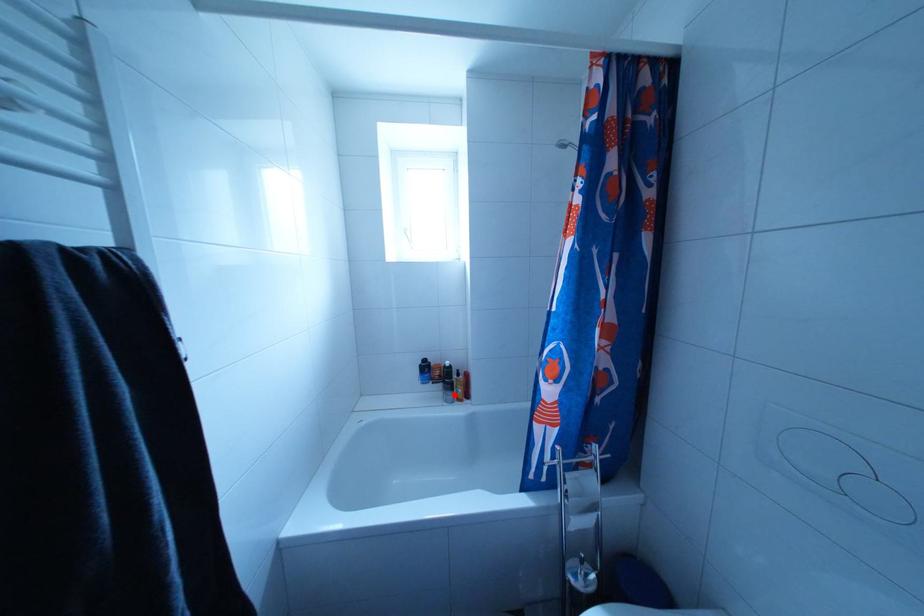
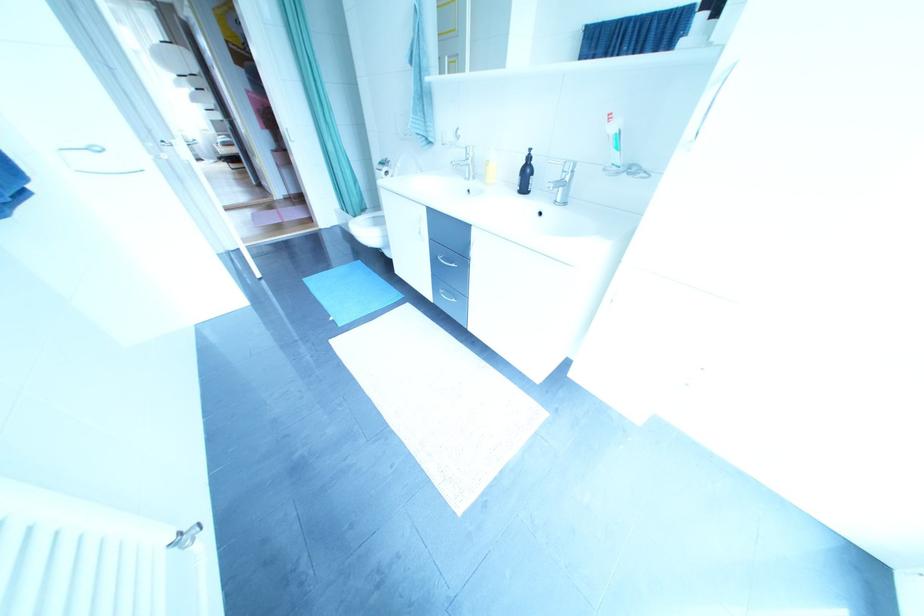
Question: I am providing you with two images of the same scene from different viewpoints. A red point is marked on the first image. At the location where the point appears in image 1, is it still visible in image 2?

Choices:
 (A) Yes
 (B) No

Answer: (B)